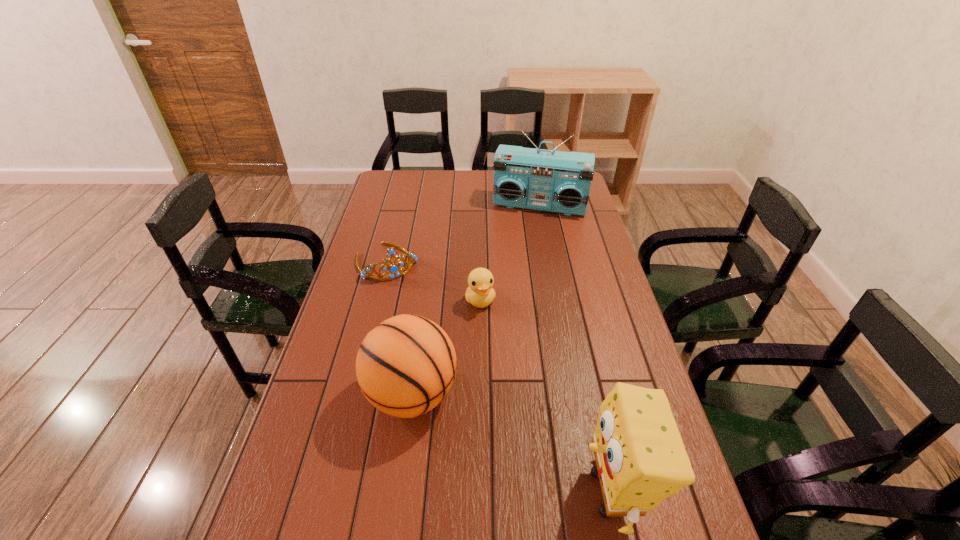
You are a GUI agent. You are given a task and a screenshot of the screen. Output one action in this format:
    pyautogui.click(x=<x>, y=<y>)
    Task: Click on the free space located on the front-facing side of the farthest object
    The image size is (960, 540).
    Given the screenshot: What is the action you would take?
    pyautogui.click(x=515, y=284)

The height and width of the screenshot is (540, 960). Find the location of `free space located 0.110m on the front-facing side of the farthest object`. free space located 0.110m on the front-facing side of the farthest object is located at coordinates (527, 235).

I want to click on vacant space located on the face of the third farthest object, so click(x=516, y=420).

Identify the location of vacant region located 0.340m on the face of the third farthest object. (512, 406).

You are a GUI agent. You are given a task and a screenshot of the screen. Output one action in this format:
    pyautogui.click(x=<x>, y=<y>)
    Task: Click on the vacant area situated 0.270m on the face of the third farthest object
    The height and width of the screenshot is (540, 960).
    Given the screenshot: What is the action you would take?
    pyautogui.click(x=505, y=384)

You are a GUI agent. You are given a task and a screenshot of the screen. Output one action in this format:
    pyautogui.click(x=<x>, y=<y>)
    Task: Click on the object present at the far edge
    
    Given the screenshot: What is the action you would take?
    pyautogui.click(x=560, y=182)

Locate an element on the screen. basketball present at the left edge is located at coordinates (405, 366).

Identify the location of tiara present at the left edge. This screenshot has height=540, width=960. (394, 268).

Where is `object located at the right edge`? The image size is (960, 540). object located at the right edge is located at coordinates (560, 182).

Where is `object at the far right corner`? This screenshot has width=960, height=540. object at the far right corner is located at coordinates click(x=560, y=182).